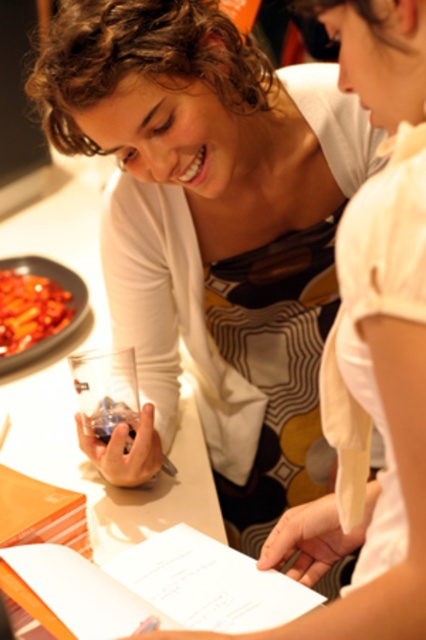
Describe the element at coordinates (74, 403) in the screenshot. I see `clear glass at center` at that location.

Find the location of a particular element. The width and height of the screenshot is (426, 640). clear glass at center is located at coordinates (74, 403).

Which is behind, point (31, 442) or point (288, 424)?

The point (288, 424) is behind.

Between clear glass at center and patterned fabric apron at center, which one has more height?

clear glass at center

Locate an element on the screen. Image resolution: width=426 pixels, height=640 pixels. clear glass at center is located at coordinates (74, 403).

Is patterned fabric apron at center further to camera compared to smooth glossy red sauce at left?

No, patterned fabric apron at center is closer to the viewer.

Is point (305, 300) in front of point (66, 294)?

Yes.

You are a GUI agent. You are given a task and a screenshot of the screen. Output one action in this format:
    pyautogui.click(x=<x>, y=<y>)
    Task: Click on the patterned fabric apron at center
    This screenshot has height=640, width=426.
    Given the screenshot: What is the action you would take?
    pyautogui.click(x=276, y=362)

I want to click on patterned fabric apron at center, so [x=276, y=362].